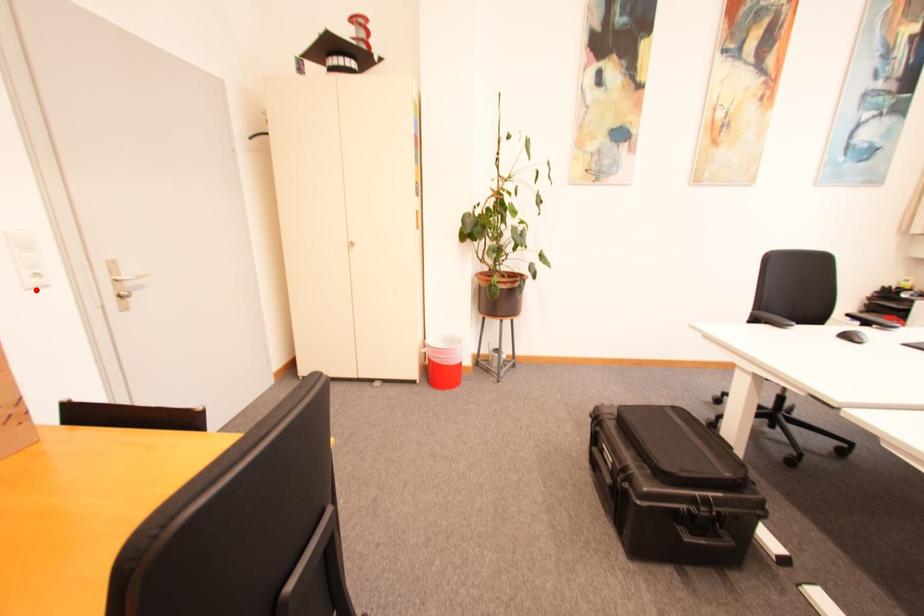
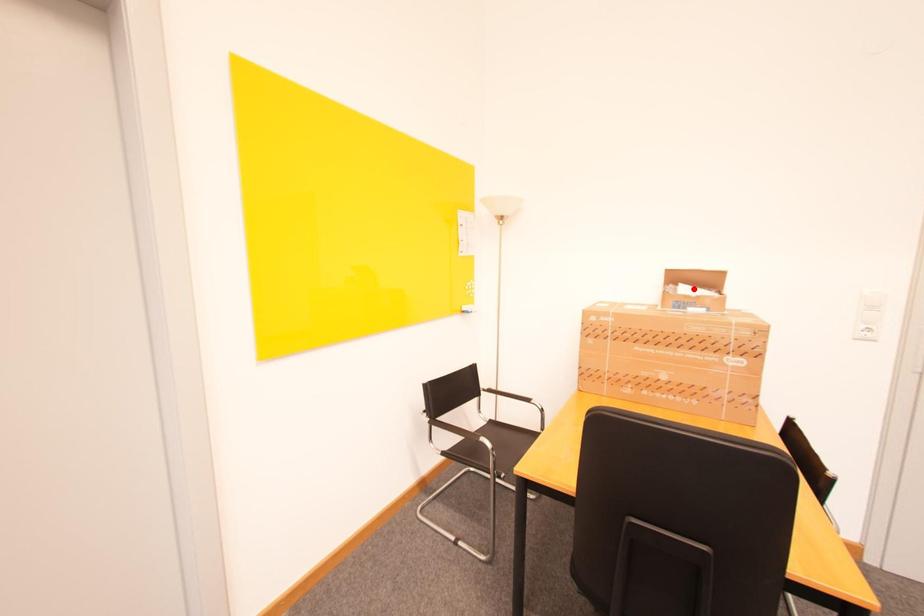
I am providing you with two images of the same scene from different viewpoints. A red point is marked on the first image and another point is marked on the second image. Is the marked point in image1 the same physical position as the marked point in image2?

No